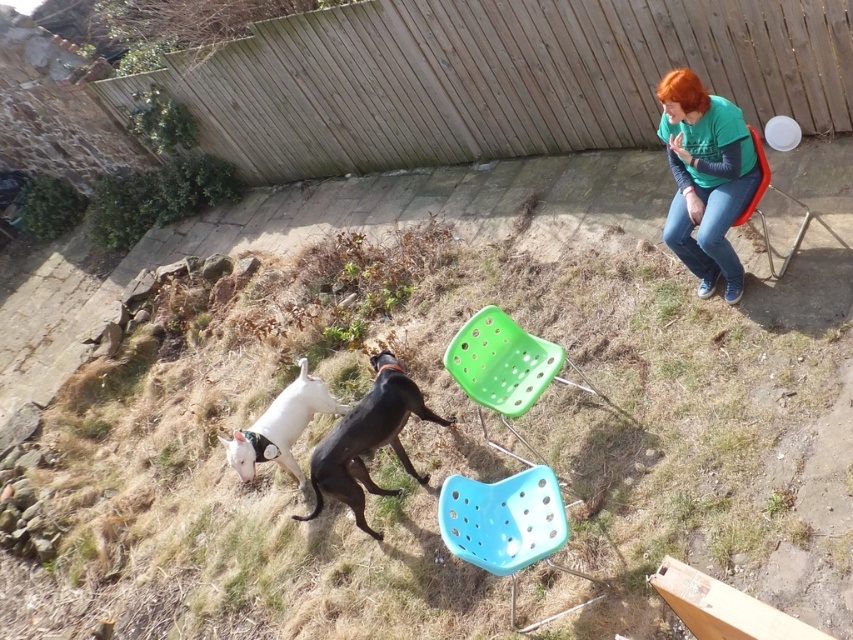
You are standing at the camera position and want to know how far the point at coordinates (326, 173) is from you. Can you determine the distance?

The point at coordinates (326, 173) is 23.60 feet away from the camera position.

You are a person standing at the edge of the backyard. You see the green plastic chair at center and the white glossy dog at lower left. Which object is closer to you?

The white glossy dog at lower left is closer to you because it is positioned lower in the scene, while the green plastic chair at center is above it.